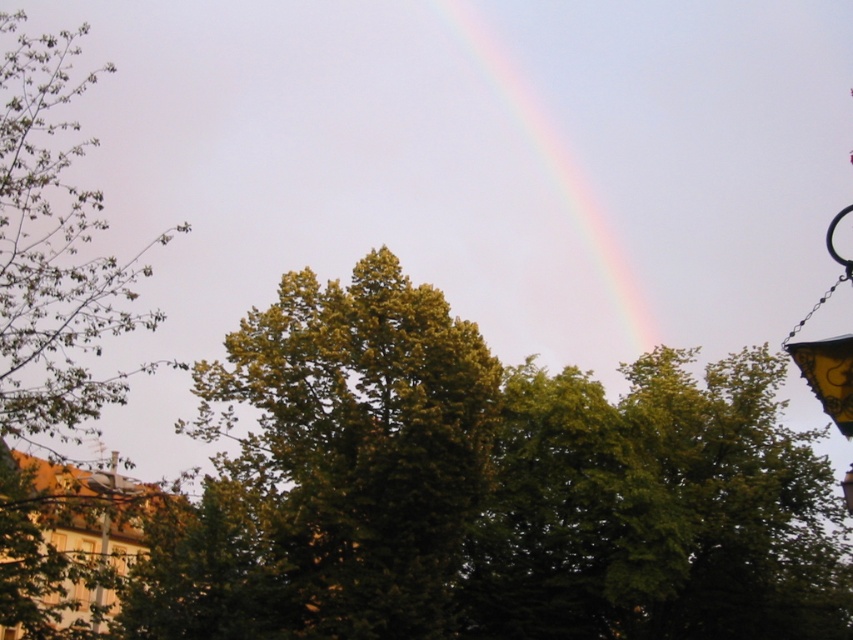
Question: Does green leafy tree at center come behind rainbow at upper center?

Choices:
 (A) yes
 (B) no

Answer: (B)

Question: Which object is closer to the camera taking this photo?

Choices:
 (A) rainbow at upper center
 (B) green leafy tree at center

Answer: (B)

Question: Based on their relative distances, which object is farther from the metallic pole at lower left?

Choices:
 (A) rainbow at upper center
 (B) green leafy tree at center

Answer: (A)

Question: Is green leafy tree at center positioned before metallic pole at lower left?

Choices:
 (A) yes
 (B) no

Answer: (B)

Question: Among these points, which one is nearest to the camera?

Choices:
 (A) (508, 51)
 (B) (107, 516)
 (C) (433, 310)

Answer: (B)

Question: Is green leafy tree at center below rainbow at upper center?

Choices:
 (A) no
 (B) yes

Answer: (B)